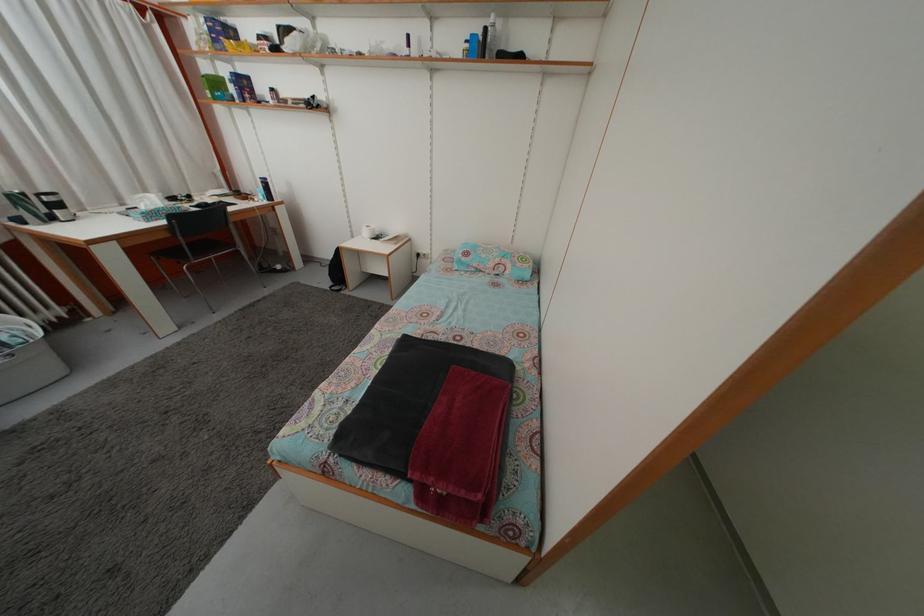
The image size is (924, 616). I want to click on black backpack, so click(x=335, y=272).